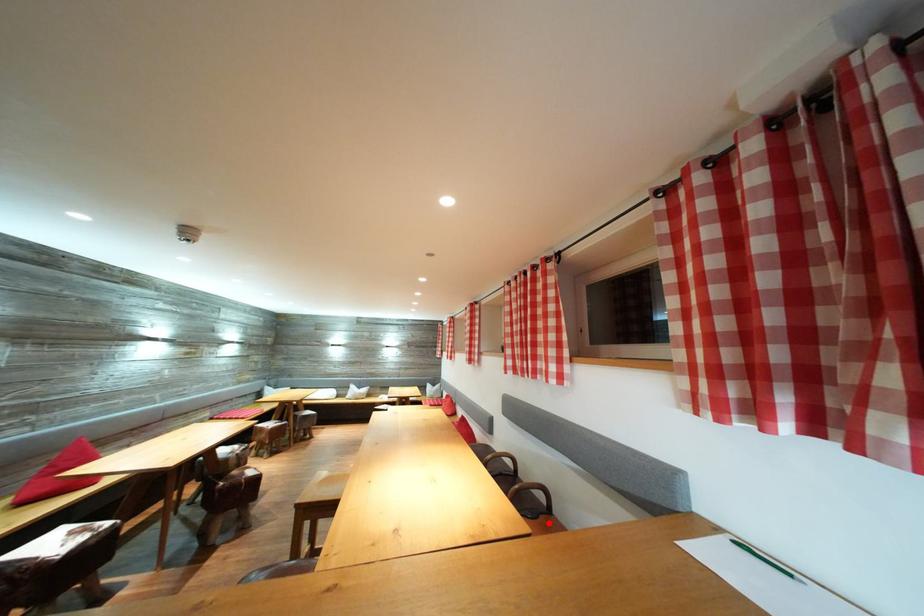
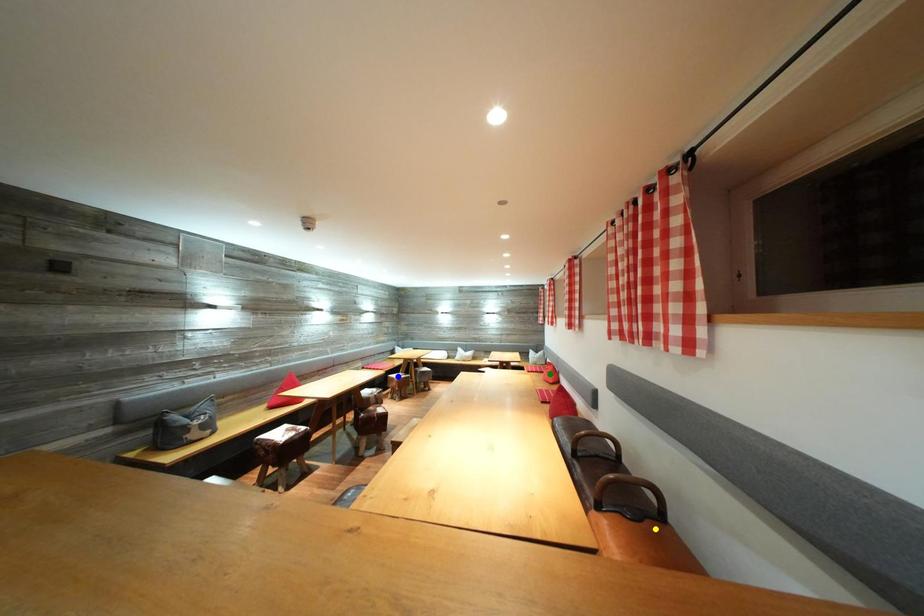
Question: I am providing you with two images of the same scene from different viewpoints. A red point is marked on the first image. You are given multiple points on the second image. Which spot in image 2 lines up with the point in image 1?

Choices:
 (A) green point
 (B) blue point
 (C) yellow point

Answer: (C)